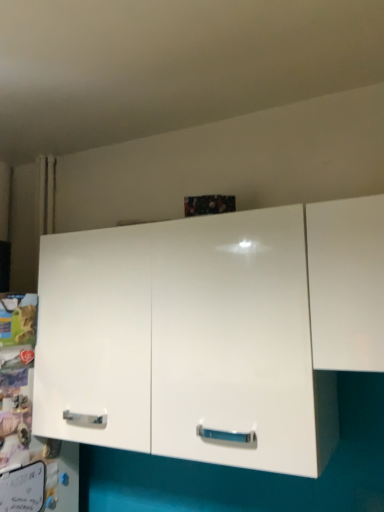
Find the location of a particular element. Image resolution: width=384 pixels, height=512 pixels. white glossy cabinet at center is located at coordinates (186, 341).

In order to face white glossy cabinet at center, should I rotate leftwards or rightwards?

Turn left by 1.990 degrees to look at white glossy cabinet at center.

Measure the distance between point (58, 432) and camera.

A distance of 1.21 meters exists between point (58, 432) and camera.

Describe the element at coordinates (186, 341) in the screenshot. This screenshot has height=512, width=384. I see `white glossy cabinet at center` at that location.

The height and width of the screenshot is (512, 384). I want to click on white glossy cabinet at center, so pos(186,341).